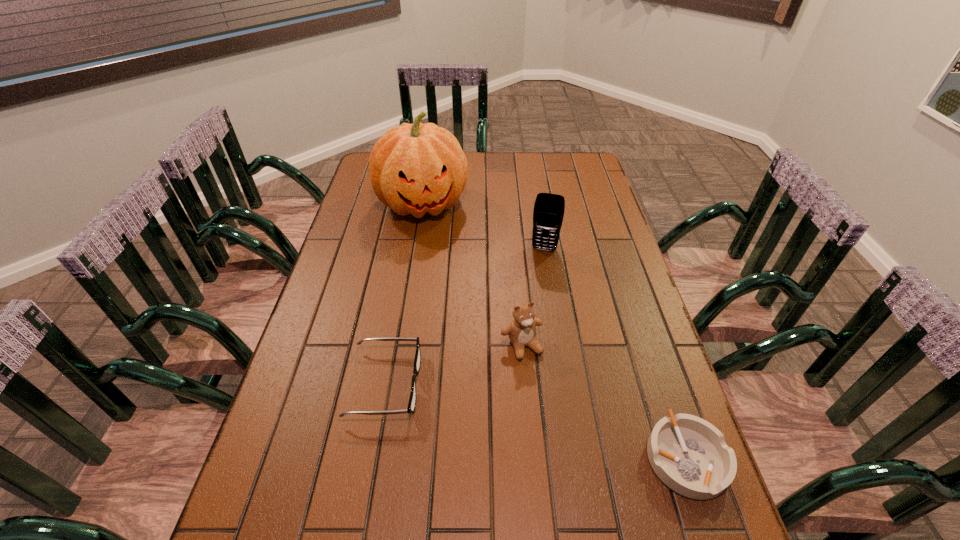
In order to click on vacant space at the far right corner of the desktop in this screenshot , I will do `click(573, 180)`.

Locate an element on the screen. Image resolution: width=960 pixels, height=540 pixels. vacant space in between the rightmost object and the third tallest object is located at coordinates (604, 402).

Find the location of `free spot between the fourth shortest object and the teddy bear`. free spot between the fourth shortest object and the teddy bear is located at coordinates (533, 298).

Where is `free space between the pumpkin and the third tallest object`? free space between the pumpkin and the third tallest object is located at coordinates (472, 275).

Locate an element on the screen. This screenshot has width=960, height=540. blank region between the farthest object and the fourth shortest object is located at coordinates 484,227.

Find the location of a particular element. The height and width of the screenshot is (540, 960). free space that is in between the fourth tallest object and the shortest object is located at coordinates (536, 421).

The width and height of the screenshot is (960, 540). I want to click on blank region between the teddy bear and the pumpkin, so click(x=472, y=275).

Locate an element on the screen. The image size is (960, 540). vacant space that's between the second shortest object and the second tallest object is located at coordinates (x=465, y=316).

Identify the location of empty location between the teddy bear and the shortest object. (604, 402).

This screenshot has height=540, width=960. In order to click on free space between the pumpkin and the third tallest object in this screenshot , I will do `click(472, 275)`.